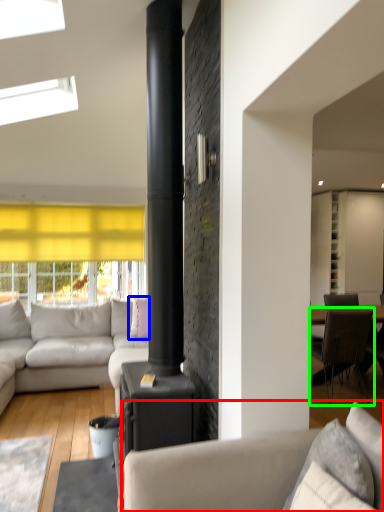
Question: Estimate the real-world distances between objects in this image. Which object is farther from studio couch (highlighted by a red box), pillow (highlighted by a blue box) or chair (highlighted by a green box)?

Choices:
 (A) pillow
 (B) chair

Answer: (A)